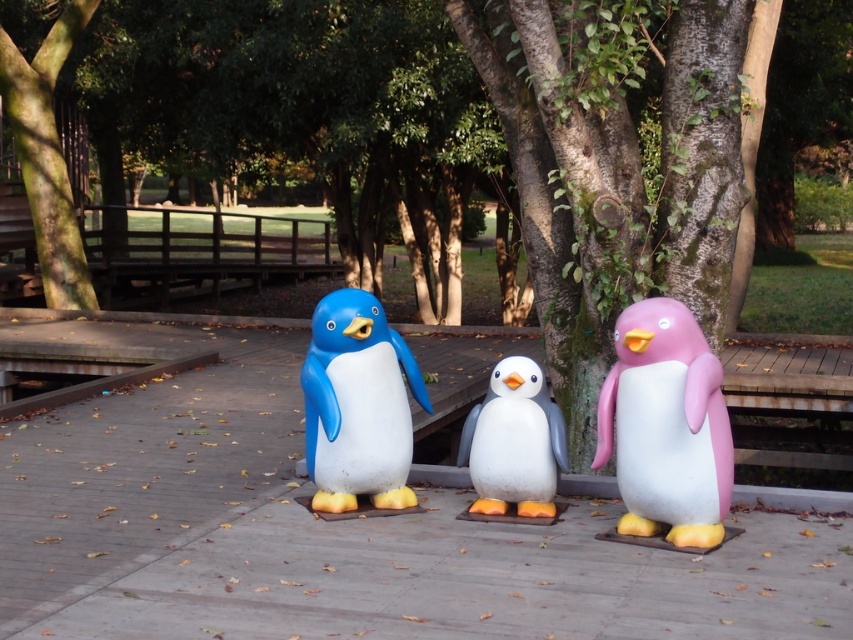
You are a bird flying above the green rough bark tree at upper center and the white matte penguin at center. If you look down, which object is directly above the other?

The green rough bark tree at upper center is positioned over the white matte penguin at center, so the green rough bark tree at upper center is directly above the white matte penguin at center.

You are standing on the wooden deck where the three penguin statues are placed. You want to take a photo of the green rough bark tree at upper center. Which direction should you face to ensure the tree is in the center of your photo?

To center the green rough bark tree at upper center in your photo, you should face upward and toward the left since its 2D coordinates are at point 0.245 on the x axis and 0.056 on the y axis, indicating it is positioned to the upper left of the image.

You are a maintenance worker who needs to measure the space between the two penguins. The minimum required space for a new plaque is 24 inches. Can the plaque fit between the matte blue penguin at center and the white matte penguin at center?

The distance between the matte blue penguin at center and the white matte penguin at center is 24.23 inches, which is just over the required 24 inches. Therefore, the plaque can fit between them.